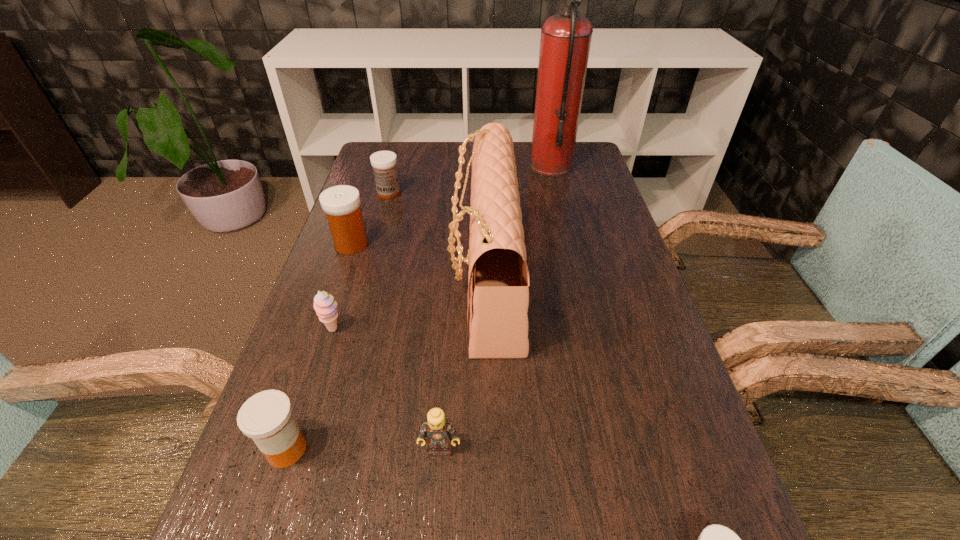
Find the location of a particular element. Image resolution: width=960 pixels, height=540 pixels. Lego is located at coordinates (440, 433).

Image resolution: width=960 pixels, height=540 pixels. I want to click on vacant space located 0.130m at the nozzle of the fire extinguisher, so click(491, 166).

What are the coordinates of `free space located 0.100m at the nozzle of the fire extinguisher` in the screenshot? It's located at (499, 166).

I want to click on vacant space located 0.350m at the nozzle of the fire extinguisher, so click(x=423, y=166).

Image resolution: width=960 pixels, height=540 pixels. I want to click on vacant space located 0.080m on the front-facing side of the second tallest object, so click(419, 280).

Image resolution: width=960 pixels, height=540 pixels. Find the location of `vacant space located 0.320m on the front-facing side of the second tallest object`. vacant space located 0.320m on the front-facing side of the second tallest object is located at coordinates (317, 280).

Find the location of `vacant point located 0.090m on the front-facing side of the second tallest object`. vacant point located 0.090m on the front-facing side of the second tallest object is located at coordinates 414,280.

Find the location of `vacant region located 0.390m on the right of the third tallest object`. vacant region located 0.390m on the right of the third tallest object is located at coordinates (519, 245).

Locate an element on the screen. The height and width of the screenshot is (540, 960). vacant space located 0.060m on the label of the orange medicine is located at coordinates (345, 449).

The image size is (960, 540). I want to click on free location located on the back of the farthest medicine, so 400,151.